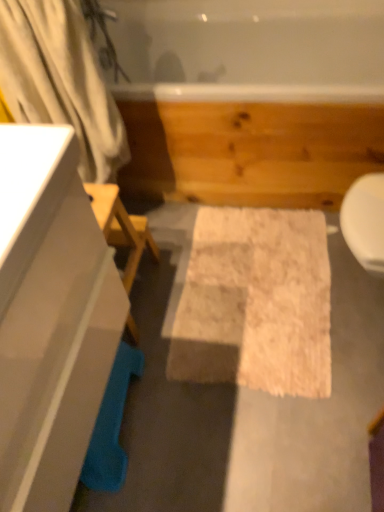
This screenshot has height=512, width=384. What do you see at coordinates (61, 80) in the screenshot?
I see `white fabric shower curtain at left` at bounding box center [61, 80].

This screenshot has height=512, width=384. I want to click on white glossy tub at upper center, so click(x=250, y=98).

What is the approximate width of white glossy cabinet at left?

The width of white glossy cabinet at left is 48.87 centimeters.

Where is `white fabric shower curtain at left`? The width and height of the screenshot is (384, 512). white fabric shower curtain at left is located at coordinates (61, 80).

Looking at this image, who is bigger, white fabric shower curtain at left or white fluffy bath mat at center?

white fabric shower curtain at left is bigger.

Are white fabric shower curtain at left and white fluffy bath mat at center making contact?

No, white fabric shower curtain at left is not with white fluffy bath mat at center.

Is white fabric shower curtain at left further to the viewer compared to white fluffy bath mat at center?

That is False.

This screenshot has height=512, width=384. I want to click on shower curtain located in front of the white fluffy bath mat at center, so click(61, 80).

The width and height of the screenshot is (384, 512). I want to click on bath mat that is below the white glossy tub at upper center (from the image's perspective), so click(256, 303).

From a real-world perspective, is white fluffy bath mat at center on top of white glossy tub at upper center?

Actually, white fluffy bath mat at center is physically below white glossy tub at upper center in the real world.

Considering the sizes of objects white fluffy bath mat at center and white glossy tub at upper center in the image provided, who is bigger, white fluffy bath mat at center or white glossy tub at upper center?

white glossy tub at upper center.

From the image's perspective, is white fluffy bath mat at center located above or below white glossy tub at upper center?

Based on their image positions, white fluffy bath mat at center is located beneath white glossy tub at upper center.

From the picture: Is white glossy cabinet at left completely or partially outside of white glossy tub at upper center?

Yes.

Looking at this image, between white glossy cabinet at left and white glossy tub at upper center, which one has less height?

Standing shorter between the two is white glossy tub at upper center.

Can you tell me how much white glossy cabinet at left and white glossy tub at upper center differ in facing direction?

The angle between the facing direction of white glossy cabinet at left and the facing direction of white glossy tub at upper center is 89.9 degrees.

Is white glossy cabinet at left further to the viewer compared to white glossy tub at upper center?

No.

Who is taller, white glossy cabinet at left or white fluffy bath mat at center?

Standing taller between the two is white glossy cabinet at left.

From a real-world perspective, is white glossy cabinet at left below white fluffy bath mat at center?

No, from a real-world perspective, white glossy cabinet at left is not under white fluffy bath mat at center.

Identify the location of bath mat directly beneath the white glossy cabinet at left (from a real-world perspective). (256, 303).

Based on their sizes in the image, would you say white glossy cabinet at left is bigger or smaller than white fluffy bath mat at center?

In the image, white glossy cabinet at left appears to be larger than white fluffy bath mat at center.

Is white fluffy bath mat at center touching white glossy cabinet at left?

They are not placed beside each other.

How different are the orientations of white fluffy bath mat at center and white glossy cabinet at left in degrees?

The angular difference between white fluffy bath mat at center and white glossy cabinet at left is 179 degrees.

From a real-world perspective, is white fluffy bath mat at center positioned above or below white glossy cabinet at left?

white fluffy bath mat at center is below white glossy cabinet at left.

Is white glossy tub at upper center positioned far away from white glossy cabinet at left?

No, white glossy tub at upper center is not far from white glossy cabinet at left.

Which is correct: white glossy tub at upper center is inside white glossy cabinet at left, or outside of it?

white glossy tub at upper center is not enclosed by white glossy cabinet at left.

How many degrees apart are the facing directions of white glossy tub at upper center and white glossy cabinet at left?

89.9 degrees separate the facing orientations of white glossy tub at upper center and white glossy cabinet at left.

The image size is (384, 512). What are the coordinates of `jacuzzi located above the white glossy cabinet at left (from the image's perspective)` in the screenshot? It's located at (250, 98).

Is point (123, 140) closer or farther from the camera than point (77, 397)?

Point (123, 140) appears to be farther away from the viewer than point (77, 397).

Between white fabric shower curtain at left and white glossy cabinet at left, which one has smaller width?

Thinner between the two is white fabric shower curtain at left.

Relative to white glossy cabinet at left, is white fabric shower curtain at left in front or behind?

Clearly, white fabric shower curtain at left is behind white glossy cabinet at left.

Which of these two, white fabric shower curtain at left or white glossy cabinet at left, stands shorter?

With less height is white fabric shower curtain at left.

The image size is (384, 512). I want to click on shower curtain on the left of the white fluffy bath mat at center, so click(x=61, y=80).

Locate an element on the screen. This screenshot has width=384, height=512. bath mat on the right of white glossy tub at upper center is located at coordinates (256, 303).

Estimate the real-world distances between objects in this image. Which object is closer to white glossy tub at upper center, white fluffy bath mat at center or white fabric shower curtain at left?

Among the two, white fluffy bath mat at center is located nearer to white glossy tub at upper center.

When comparing their distances from white glossy cabinet at left, does white fluffy bath mat at center or white glossy tub at upper center seem further?

Among the two, white glossy tub at upper center is located further to white glossy cabinet at left.

When comparing their distances from white glossy tub at upper center, does white glossy cabinet at left or white fluffy bath mat at center seem closer?

Based on the image, white fluffy bath mat at center appears to be nearer to white glossy tub at upper center.

Estimate the real-world distances between objects in this image. Which object is further from white glossy cabinet at left, white fabric shower curtain at left or white glossy tub at upper center?

Based on the image, white glossy tub at upper center appears to be further to white glossy cabinet at left.

From the image, which object appears to be nearer to white glossy tub at upper center, white fabric shower curtain at left or white glossy cabinet at left?

white fabric shower curtain at left lies closer to white glossy tub at upper center than the other object.

When comparing their distances from white glossy tub at upper center, does white glossy cabinet at left or white fabric shower curtain at left seem further?

Among the two, white glossy cabinet at left is located further to white glossy tub at upper center.

Considering their positions, is white glossy cabinet at left positioned closer to white fabric shower curtain at left than white fluffy bath mat at center?

white glossy cabinet at left.

Considering their positions, is white glossy tub at upper center positioned further to white fabric shower curtain at left than white glossy cabinet at left?

white glossy cabinet at left.

I want to click on shower curtain between white glossy tub at upper center and white glossy cabinet at left in the up-down direction, so click(x=61, y=80).

The image size is (384, 512). I want to click on shower curtain between white glossy tub at upper center and white fluffy bath mat at center in the up-down direction, so click(x=61, y=80).

Locate an element on the screen. shower curtain between white glossy cabinet at left and white fluffy bath mat at center from front to back is located at coordinates (61, 80).

At what (x,y) coordinates should I click in order to perform the action: click on bath mat between white glossy tub at upper center and white glossy cabinet at left in the up-down direction. Please return your answer as a coordinate pair (x, y). The image size is (384, 512). Looking at the image, I should click on (256, 303).